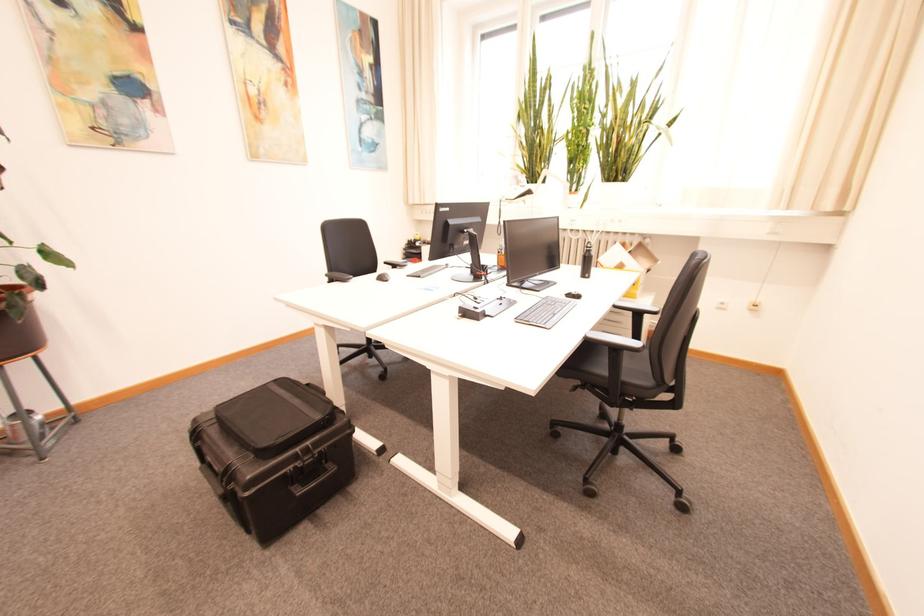
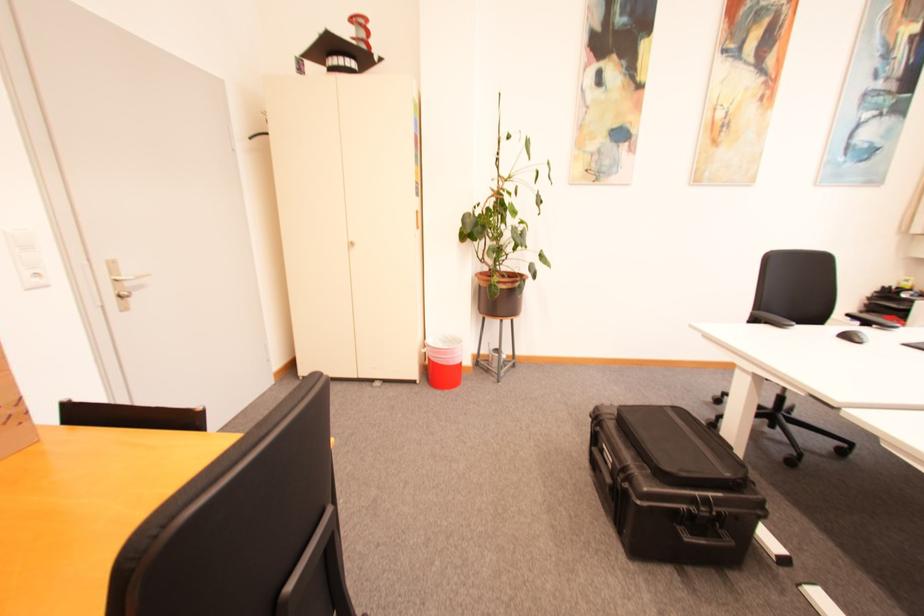
Find the pixel in the second image that matches (x=334, y=277) in the first image.

(759, 315)